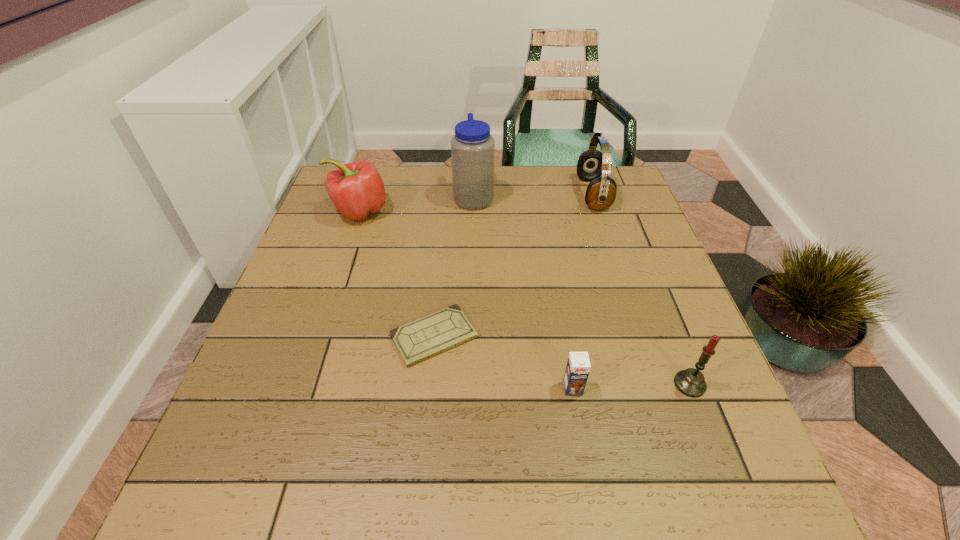
Locate an element on the screen. The image size is (960, 540). free space that is in between the chocolate milk and the headset is located at coordinates (583, 291).

Where is `free space that is in between the fourth object from left to right and the bell pepper`? This screenshot has width=960, height=540. free space that is in between the fourth object from left to right and the bell pepper is located at coordinates (466, 300).

At what (x,y) coordinates should I click in order to perform the action: click on vacant area that lies between the third object from right to left and the candle. Please return your answer as a coordinate pair (x, y). The image size is (960, 540). Looking at the image, I should click on (632, 386).

You are a GUI agent. You are given a task and a screenshot of the screen. Output one action in this format:
    pyautogui.click(x=<x>, y=<y>)
    Task: Click on the unoccupied position between the candle and the leftmost object
    
    Given the screenshot: What is the action you would take?
    pyautogui.click(x=524, y=298)

The width and height of the screenshot is (960, 540). What are the coordinates of `free space between the headset and the water bottle` in the screenshot? It's located at (533, 195).

The height and width of the screenshot is (540, 960). What are the coordinates of `free spot between the headset and the checkbook` in the screenshot? It's located at [x=514, y=265].

Where is `vacant region between the tallest object and the leftmost object`? This screenshot has height=540, width=960. vacant region between the tallest object and the leftmost object is located at coordinates (417, 204).

The height and width of the screenshot is (540, 960). I want to click on empty space between the shortest object and the headset, so click(514, 265).

Locate an element on the screen. the second closest object to the bell pepper is located at coordinates (416, 341).

Point out which object is positioned as the fifth nearest to the candle. Please provide its 2D coordinates. Your answer should be formatted as a tuple, i.e. [(x, y)], where the tuple contains the x and y coordinates of a point satisfying the conditions above.

[(356, 189)]